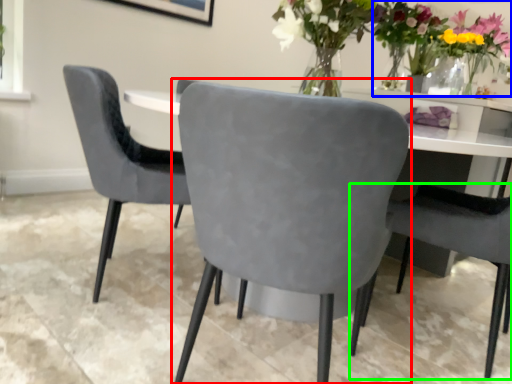
Question: Considering the real-world distances, which object is closest to chair (highlighted by a red box)? floral arrangement (highlighted by a blue box) or chair (highlighted by a green box).

Choices:
 (A) floral arrangement
 (B) chair

Answer: (B)